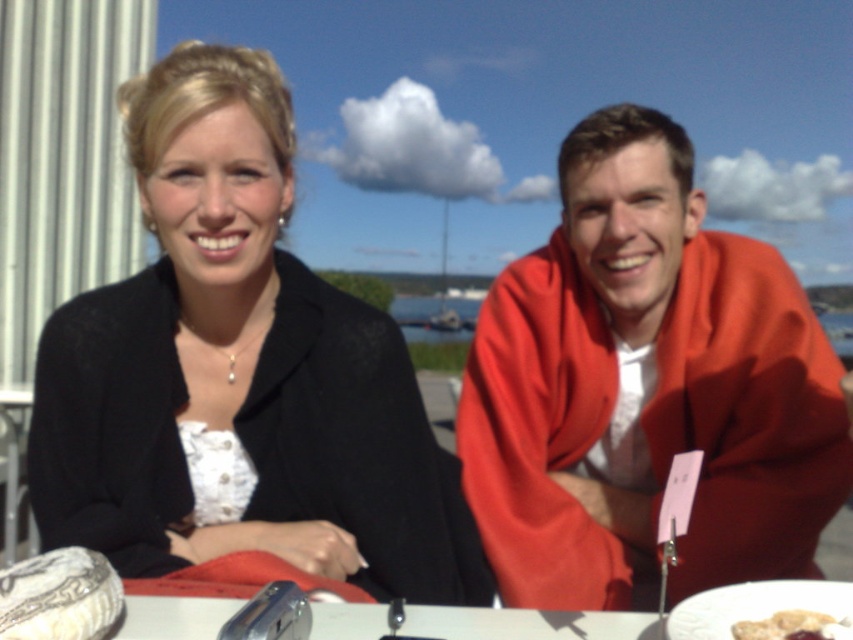
You are a photographer setting up a shot of the two people at the table. You need to ensure that the matte red jacket at center and the smooth white bread at lower right are both in focus. Given their sizes, which object should you adjust your camera focus to prioritize for a sharp image?

The matte red jacket at center is bigger than the smooth white bread at lower right, so you should prioritize focusing on the matte red jacket at center to ensure it appears sharp in the photo.

You are a photographer setting up a shoot at this table. You need to place a 12 inch wide prop between the black matte blazer at center and the white ceramic plate at lower right. Will the space between them accommodate the prop?

The black matte blazer at center is wider than the white ceramic plate at lower right. However, the question is about the space between them, not their individual widths. The provided information does not specify the distance between the two objects, so it is impossible to determine if the 12 inch prop will fit. Additional measurements are needed.

You are standing at the origin of the coordinate system. There is a point at coordinate (645,388). What object is located at that point?

The point at coordinate (645,388) corresponds to the matte red jacket at center.